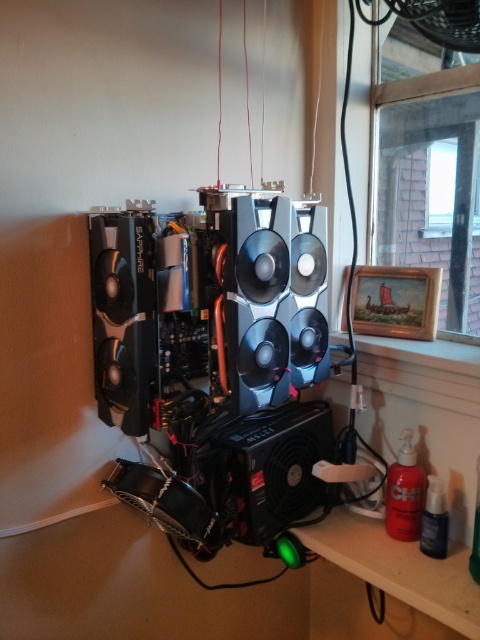
You are a technician who needs to replace the black plastic speaker at center. The replacement speaker is 1.5 meters wide. Will it fit in the space between the Sapphire graphics cards and the black power supply unit at the bottom?

The space between the Sapphire graphics cards and the black power supply unit at the bottom is 1.26 meters. Since the replacement speaker is 1.5 meters wide, it will not fit in the available space.

You are standing in the room and want to place a new monitor exactly where the black plastic speaker at center is currently located. Is the space at that location suitable for placing the monitor?

The black plastic speaker at center is located at point 2D coordinates of (264, 467). Since the speaker is already occupying that exact spot, you would need to move it to place the monitor there.